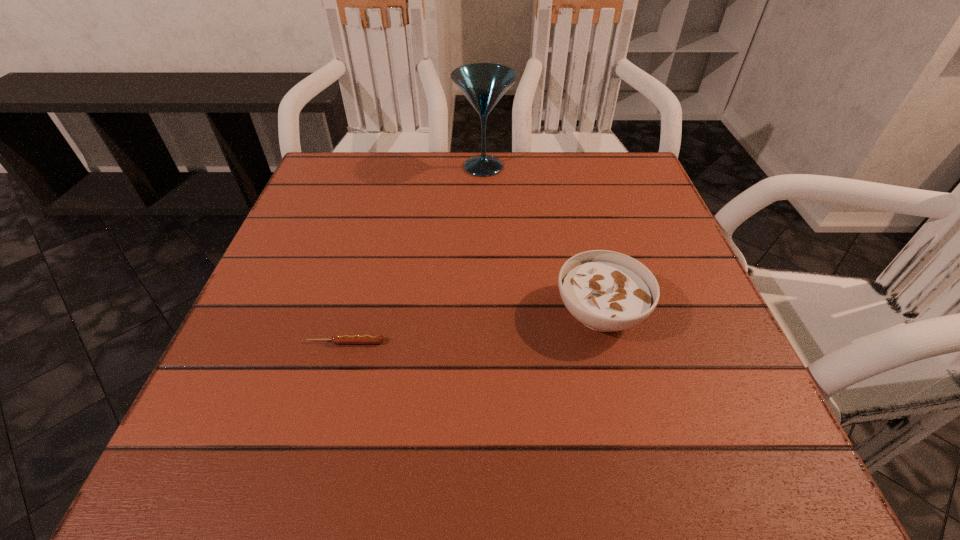
Find the location of a particular element. object that is at the left edge is located at coordinates (336, 339).

Identify the location of object located in the right edge section of the desktop. The width and height of the screenshot is (960, 540). 606,291.

This screenshot has height=540, width=960. I want to click on vacant space at the far edge of the desktop, so click(x=554, y=162).

In the image, there is a desktop. At what (x,y) coordinates should I click in order to perform the action: click on vacant area at the near edge. Please return your answer as a coordinate pair (x, y). The image size is (960, 540). Looking at the image, I should click on (408, 440).

Where is `free space at the left edge`? This screenshot has height=540, width=960. free space at the left edge is located at coordinates (334, 222).

You are a GUI agent. You are given a task and a screenshot of the screen. Output one action in this format:
    pyautogui.click(x=<x>, y=<y>)
    Task: Click on the free location at the right edge
    Image resolution: width=960 pixels, height=540 pixels.
    Given the screenshot: What is the action you would take?
    pyautogui.click(x=687, y=267)

I want to click on free point at the far left corner, so click(347, 191).

Identify the location of vacant space at the far right corner of the desktop. Image resolution: width=960 pixels, height=540 pixels. (660, 202).

Image resolution: width=960 pixels, height=540 pixels. In the image, there is a desktop. What are the coordinates of `vacant space at the near right corner` in the screenshot? It's located at (741, 442).

Where is `free space between the leftmost object and the soup bowl`? Image resolution: width=960 pixels, height=540 pixels. free space between the leftmost object and the soup bowl is located at coordinates (473, 327).